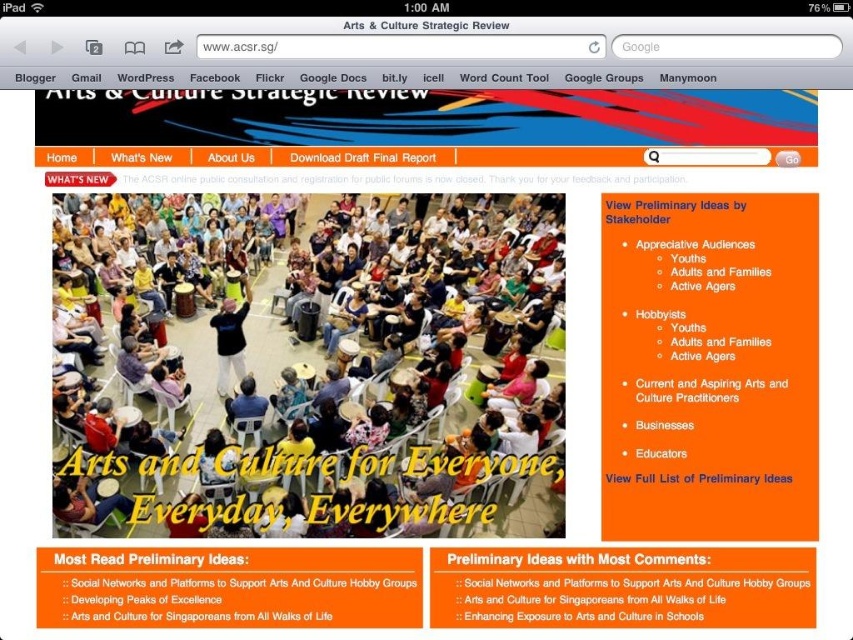
Is matte plastic chairs at lower center taller than black matte shirt at center?

In fact, matte plastic chairs at lower center may be shorter than black matte shirt at center.

Is matte plastic chairs at lower center further to the viewer compared to black matte shirt at center?

No, it is in front of black matte shirt at center.

What do you see at coordinates (328, 419) in the screenshot?
I see `matte plastic chairs at lower center` at bounding box center [328, 419].

Identify the location of matte plastic chairs at lower center. (328, 419).